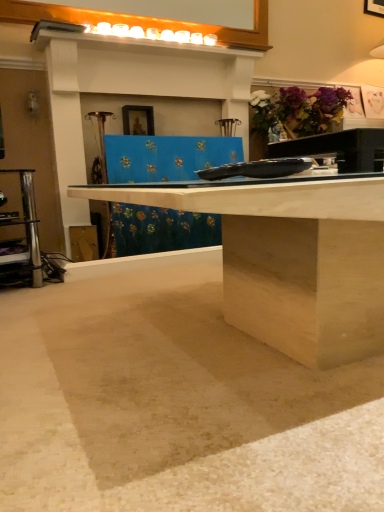
Question: Is wooden framed picture at upper center positioned behind beige matte concrete at lower center?

Choices:
 (A) yes
 (B) no

Answer: (A)

Question: Considering the relative sizes of wooden framed picture at upper center and beige matte concrete at lower center in the image provided, is wooden framed picture at upper center wider than beige matte concrete at lower center?

Choices:
 (A) no
 (B) yes

Answer: (A)

Question: Is beige matte concrete at lower center completely or partially inside wooden framed picture at upper center?

Choices:
 (A) yes
 (B) no

Answer: (B)

Question: Is wooden framed picture at upper center thinner than beige matte concrete at lower center?

Choices:
 (A) no
 (B) yes

Answer: (B)

Question: From a real-world perspective, is wooden framed picture at upper center below beige matte concrete at lower center?

Choices:
 (A) no
 (B) yes

Answer: (A)

Question: Is wooden framed picture at upper center directly adjacent to beige matte concrete at lower center?

Choices:
 (A) yes
 (B) no

Answer: (B)

Question: Can we say wooden framed picture at upper center lies outside purple matte flower at upper right?

Choices:
 (A) yes
 (B) no

Answer: (A)

Question: Can you confirm if wooden framed picture at upper center is thinner than purple matte flower at upper right?

Choices:
 (A) no
 (B) yes

Answer: (B)

Question: From a real-world perspective, is wooden framed picture at upper center positioned under purple matte flower at upper right based on gravity?

Choices:
 (A) no
 (B) yes

Answer: (B)

Question: Does wooden framed picture at upper center appear on the right side of purple matte flower at upper right?

Choices:
 (A) no
 (B) yes

Answer: (A)

Question: Is wooden framed picture at upper center smaller than purple matte flower at upper right?

Choices:
 (A) no
 (B) yes

Answer: (B)

Question: Is wooden framed picture at upper center bigger than purple matte flower at upper right?

Choices:
 (A) no
 (B) yes

Answer: (A)

Question: Are purple matte flower at upper right and beige matte concrete at lower center making contact?

Choices:
 (A) yes
 (B) no

Answer: (B)